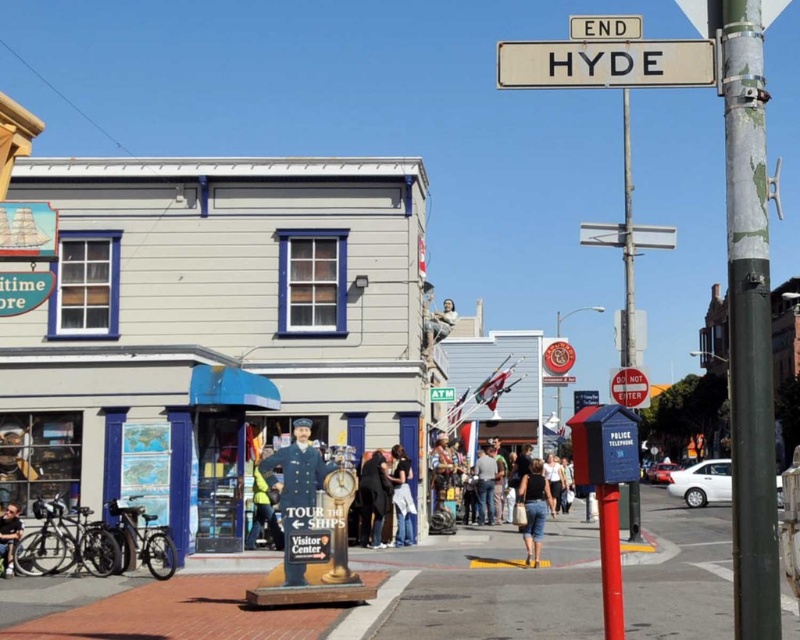
Can you confirm if metallic pole at upper right is wider than denim pants at center?

Indeed, metallic pole at upper right has a greater width compared to denim pants at center.

Between point (628, 332) and point (478, 500), which one is positioned behind?

The point (478, 500) is behind.

Which is behind, point (625, 240) or point (494, 515)?

The point (494, 515) is behind.

Image resolution: width=800 pixels, height=640 pixels. Identify the location of metallic pole at upper right. (628, 244).

Does brick pavement at center have a greater width compared to uniformed statue at center?

Yes.

Find the location of a particular element. This screenshot has width=800, height=640. brick pavement at center is located at coordinates (337, 608).

This screenshot has height=640, width=800. Identify the location of brick pavement at center. (337, 608).

Can you confirm if green peeling paint pole at upper right is smaller than dark blue jeans at center?

Incorrect, green peeling paint pole at upper right is not smaller in size than dark blue jeans at center.

Which is in front, point (748, 602) or point (400, 460)?

Point (748, 602)

Locate an element on the screen. The height and width of the screenshot is (640, 800). green peeling paint pole at upper right is located at coordinates (748, 321).